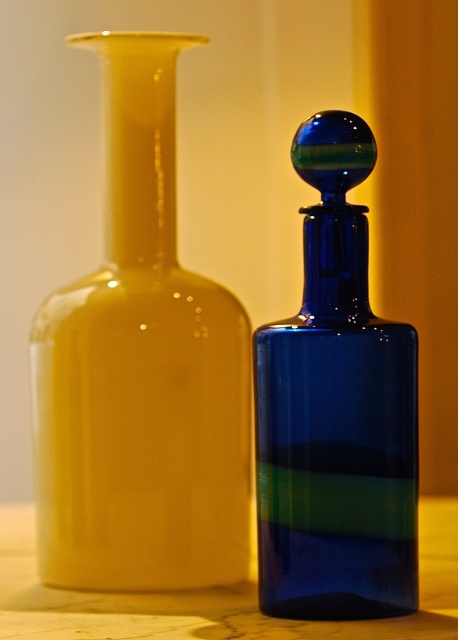
Is matte yellow glass vase at left closer to the viewer compared to blue glass bottle at center?

That is False.

The width and height of the screenshot is (458, 640). Describe the element at coordinates (141, 371) in the screenshot. I see `matte yellow glass vase at left` at that location.

At what (x,y) coordinates should I click in order to perform the action: click on matte yellow glass vase at left. Please return your answer as a coordinate pair (x, y). Looking at the image, I should click on (141, 371).

Can you confirm if matte yellow glass vase at left is bigger than wooden table at center?

Incorrect, matte yellow glass vase at left is not larger than wooden table at center.

Who is more forward, (159, 259) or (436, 518)?

Positioned in front is point (159, 259).

Which is in front, point (165, 566) or point (412, 620)?

Point (412, 620) is more forward.

Locate an element on the screen. This screenshot has width=458, height=640. matte yellow glass vase at left is located at coordinates (141, 371).

Does blue glass bottle at center appear over wooden table at center?

Indeed, blue glass bottle at center is positioned over wooden table at center.

Who is more forward, (370, 154) or (92, 612)?

Positioned in front is point (370, 154).

Who is more forward, (309, 301) or (116, 609)?

Positioned in front is point (309, 301).

Locate an element on the screen. The height and width of the screenshot is (640, 458). blue glass bottle at center is located at coordinates 336,412.